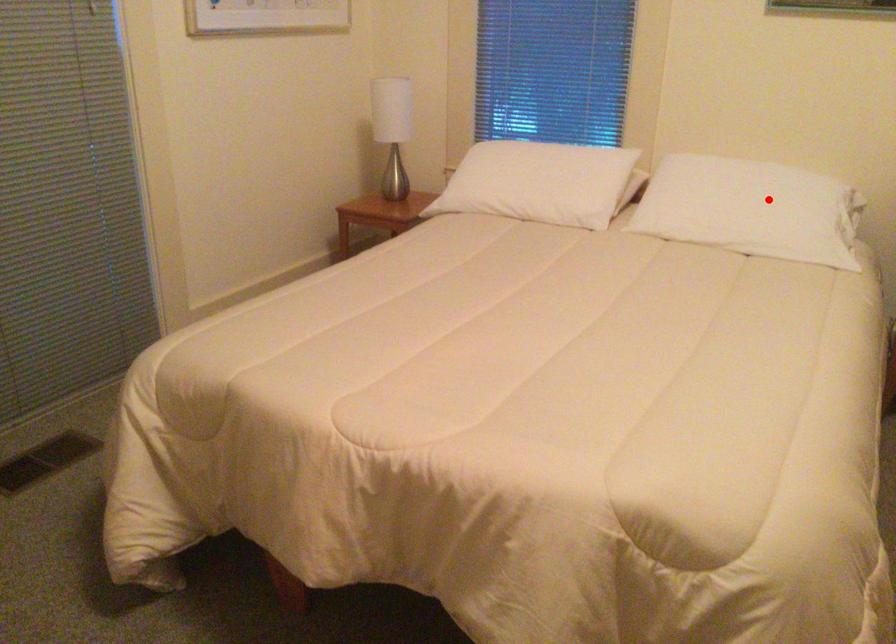
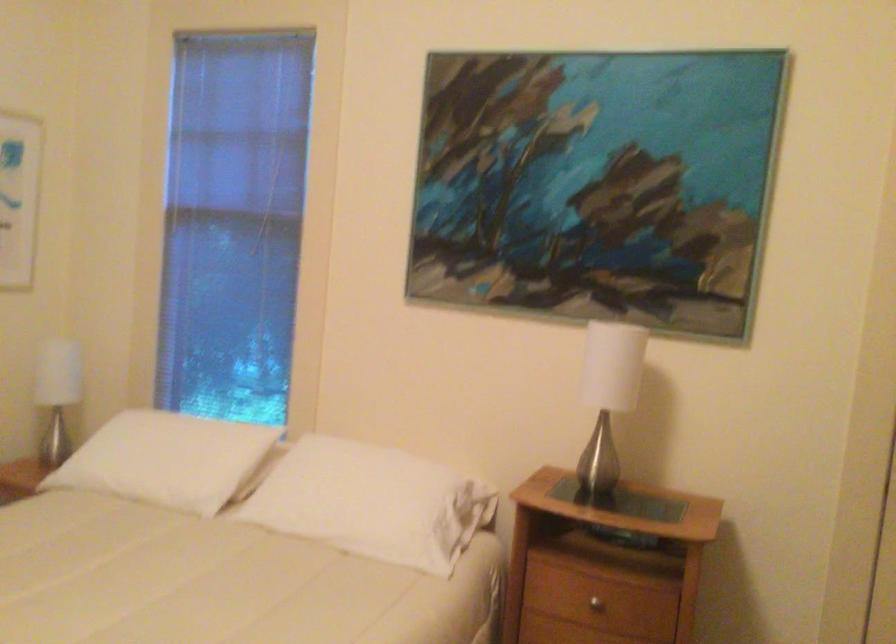
Locate, in the second image, the point that corresponds to the highlighted location in the first image.

(373, 502)